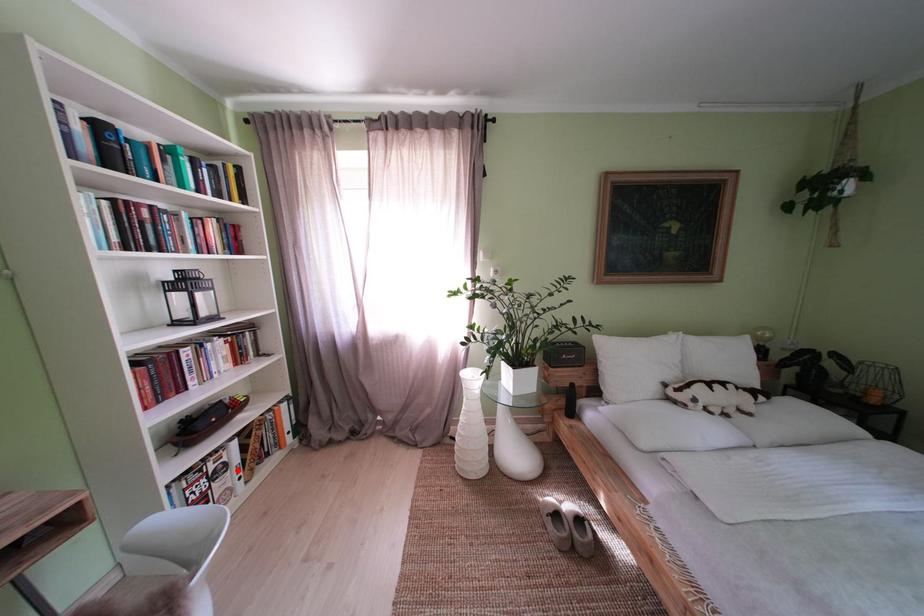
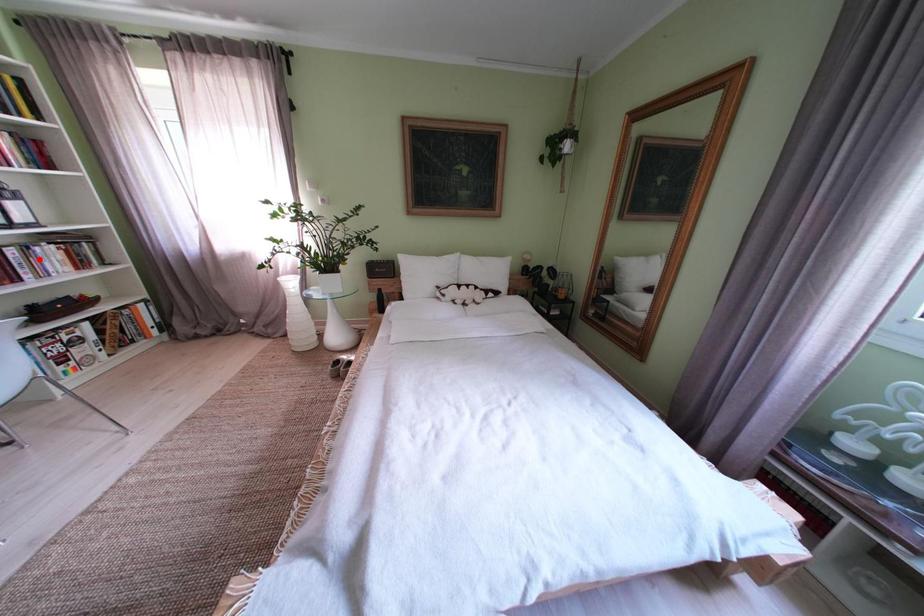
I am providing you with two images of the same scene from different viewpoints. A red point is marked on the first image and another point is marked on the second image. Does the point marked in image1 correspond to the same location as the one in image2?

No